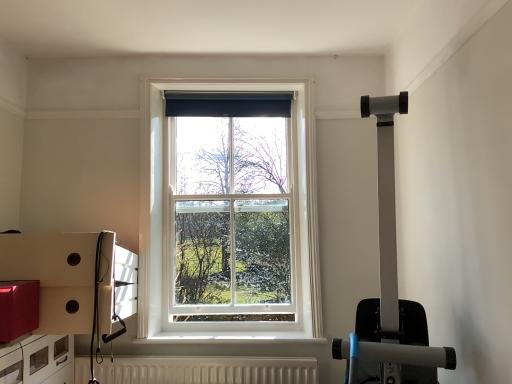
This screenshot has width=512, height=384. What are the coordinates of `free spot above white textured radiator at lower center (from a real-world perspective)` in the screenshot? It's located at (203, 353).